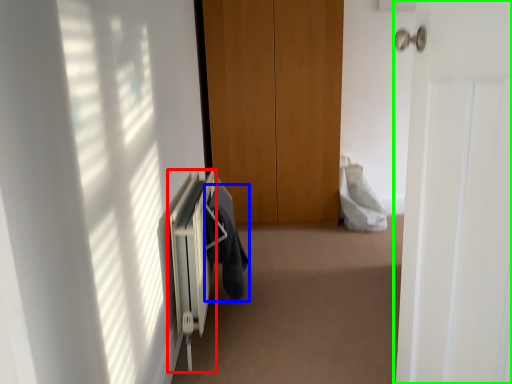
Question: Estimate the real-world distances between objects in this image. Which object is closer to radiator (highlighted by a red box), garment (highlighted by a blue box) or door (highlighted by a green box)?

Choices:
 (A) garment
 (B) door

Answer: (A)